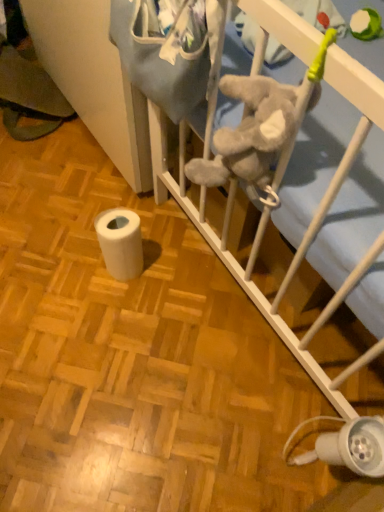
Question: Is white soft infant bed at center spatially inside white matte toilet paper at lower left, or outside of it?

Choices:
 (A) outside
 (B) inside

Answer: (A)

Question: Looking at their shapes, would you say white soft infant bed at center is wider or thinner than white matte toilet paper at lower left?

Choices:
 (A) wide
 (B) thin

Answer: (A)

Question: Which of these objects is positioned farthest from the white matte toilet paper at lower left?

Choices:
 (A) white plastic lamp at lower right
 (B) white soft infant bed at center

Answer: (A)

Question: Which is farther from the white matte toilet paper at lower left?

Choices:
 (A) white plastic lamp at lower right
 (B) white soft infant bed at center

Answer: (A)